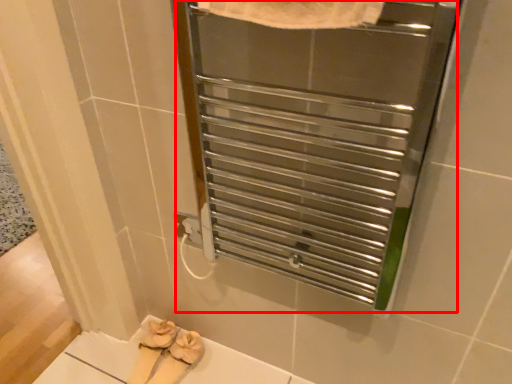
Question: From the image's perspective, what is the correct spatial relationship of screen door (annotated by the red box) in relation to footwear?

Choices:
 (A) above
 (B) below

Answer: (A)